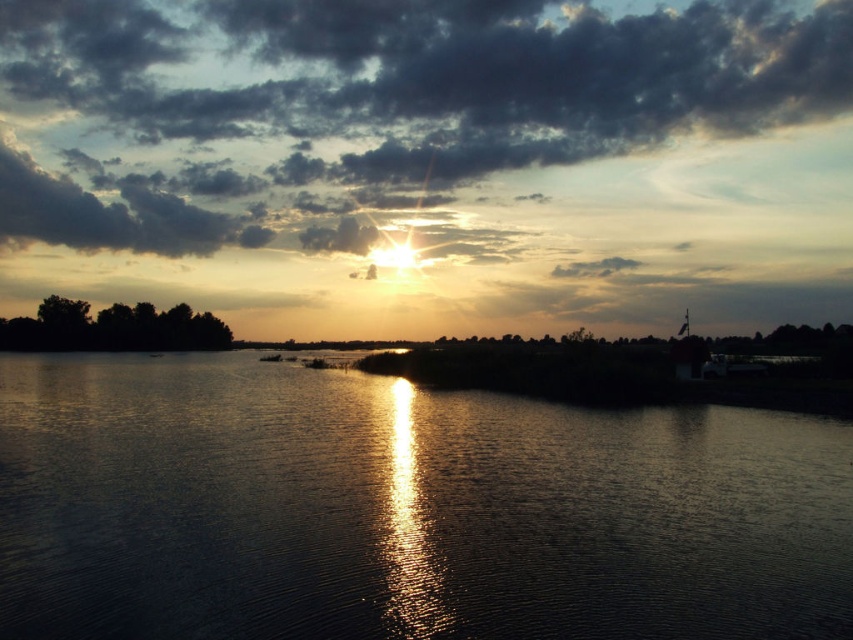
Question: Does silvery reflective water at center lie in front of smokey gray cloud at upper center?

Choices:
 (A) no
 (B) yes

Answer: (B)

Question: Which of the following is the closest to the observer?

Choices:
 (A) silvery reflective water at center
 (B) smokey gray cloud at upper center

Answer: (A)

Question: Is silvery reflective water at center closer to the viewer compared to smokey gray cloud at upper center?

Choices:
 (A) yes
 (B) no

Answer: (A)

Question: Can you confirm if silvery reflective water at center is thinner than smokey gray cloud at upper center?

Choices:
 (A) no
 (B) yes

Answer: (B)

Question: Which point appears closest to the camera in this image?

Choices:
 (A) (9, 627)
 (B) (700, 28)

Answer: (A)

Question: Which of the following is the farthest from the observer?

Choices:
 (A) (131, 380)
 (B) (120, 97)

Answer: (B)